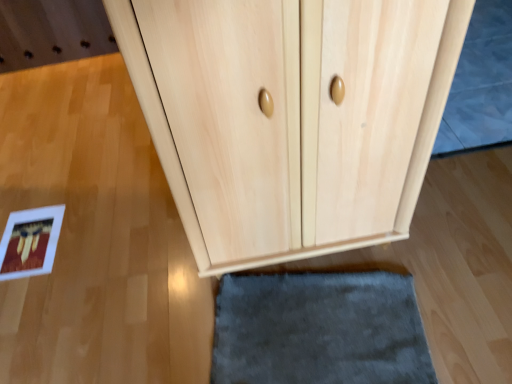
Question: Is light wood door at center to the left of gray soft rug at upper right from the viewer's perspective?

Choices:
 (A) yes
 (B) no

Answer: (A)

Question: From a real-world perspective, is light wood door at center located beneath gray soft rug at upper right?

Choices:
 (A) yes
 (B) no

Answer: (B)

Question: Can you confirm if light wood door at center is shorter than gray soft rug at upper right?

Choices:
 (A) yes
 (B) no

Answer: (B)

Question: From the image's perspective, would you say light wood door at center is positioned over gray soft rug at upper right?

Choices:
 (A) no
 (B) yes

Answer: (A)

Question: Is light wood door at center oriented towards gray soft rug at upper right?

Choices:
 (A) no
 (B) yes

Answer: (A)

Question: Considering the positions of point (472, 137) and point (334, 271), is point (472, 137) closer or farther from the camera than point (334, 271)?

Choices:
 (A) closer
 (B) farther

Answer: (B)

Question: Considering their positions, is gray soft rug at upper right located in front of or behind light wood door at center?

Choices:
 (A) behind
 (B) front

Answer: (A)

Question: Considering the positions of gray soft rug at upper right and light wood door at center in the image, is gray soft rug at upper right taller or shorter than light wood door at center?

Choices:
 (A) short
 (B) tall

Answer: (A)

Question: Is gray soft rug at upper right inside the boundaries of light wood door at center, or outside?

Choices:
 (A) inside
 (B) outside

Answer: (B)

Question: Considering their positions, is light wood door at center located in front of or behind natural wood cupboard at center?

Choices:
 (A) behind
 (B) front

Answer: (A)

Question: In the image, is light wood door at center on the left side or the right side of natural wood cupboard at center?

Choices:
 (A) right
 (B) left

Answer: (A)

Question: Is light wood door at center wider or thinner than natural wood cupboard at center?

Choices:
 (A) thin
 (B) wide

Answer: (A)

Question: From a real-world perspective, is light wood door at center positioned above or below natural wood cupboard at center?

Choices:
 (A) below
 (B) above

Answer: (A)

Question: Is gray soft rug at upper right wider or thinner than natural wood cupboard at center?

Choices:
 (A) thin
 (B) wide

Answer: (B)

Question: Is gray soft rug at upper right inside the boundaries of natural wood cupboard at center, or outside?

Choices:
 (A) inside
 (B) outside

Answer: (B)